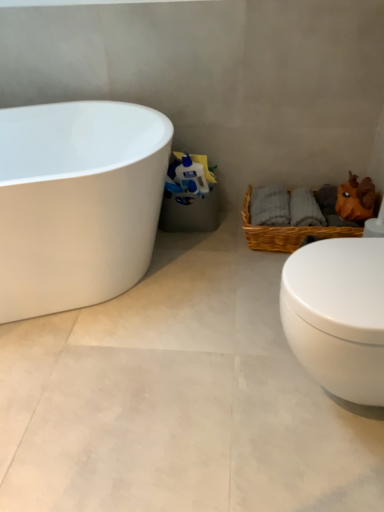
Question: Is woven brown picnic basket at lower right wider or thinner than white glossy toilet at lower right?

Choices:
 (A) thin
 (B) wide

Answer: (B)

Question: Do you think woven brown picnic basket at lower right is within white glossy toilet at lower right, or outside of it?

Choices:
 (A) inside
 (B) outside

Answer: (B)

Question: Which is farther from the white glossy toilet paper at center?

Choices:
 (A) woven brown picnic basket at lower right
 (B) white glossy bathtub at left
 (C) white glossy toilet at lower right

Answer: (C)

Question: Estimate the real-world distances between objects in this image. Which object is farther from the white glossy bathtub at left?

Choices:
 (A) white glossy toilet at lower right
 (B) white glossy toilet paper at center
 (C) woven brown picnic basket at lower right

Answer: (A)